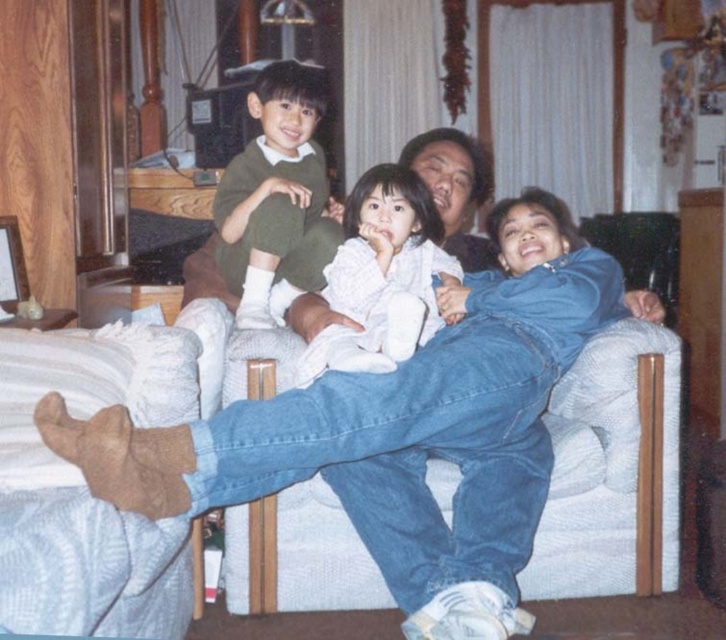
Consider the image. You are organizing a charity event and need to decide whether to donate the matte green sweater at center and the white soft blanket at center. Since the sweater is smaller, will it fit in the same donation box as the blanket?

The matte green sweater at center is smaller than the white soft blanket at center, so it will fit in the same donation box as the blanket.

You are a tailor measuring the distance between two items in the living room scene. The items are the matte green sweater at center and the white soft blanket at center. The minimum space required for your measuring tape to fit between them is 12 inches. Can your tape measure fit between them?

The distance between the matte green sweater at center and the white soft blanket at center is 11.52 inches, which is less than the 12 inches required. Therefore, the measuring tape cannot fit between them.

You are standing in the living room and want to place a small decorative item exactly where the matte green sweater at center is located. Can you confirm the coordinates where you should place it?

The matte green sweater at center is located at point (277, 198), so place the decorative item there.